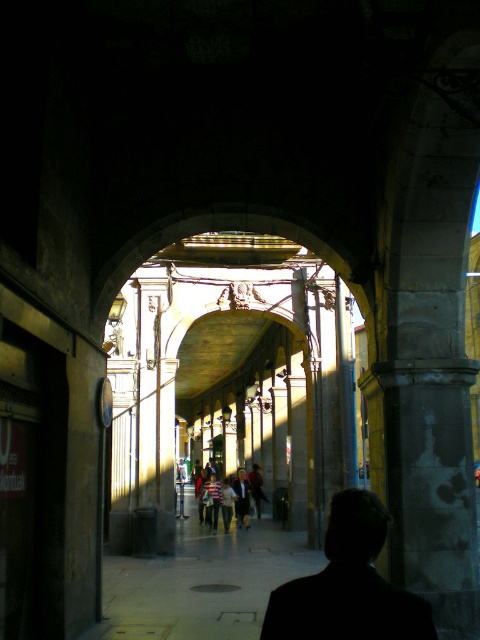
Question: In this image, where is black matte suit at center located relative to striped fabric shirt at center?

Choices:
 (A) above
 (B) below

Answer: (A)

Question: Which object is the farthest from the dark gray suit at center?

Choices:
 (A) black matte suit at center
 (B) striped fabric shirt at center

Answer: (A)

Question: Is black matte suit at center bigger than striped fabric shirt at center?

Choices:
 (A) yes
 (B) no

Answer: (A)

Question: Which object is closer to the camera taking this photo?

Choices:
 (A) striped fabric shirt at center
 (B) black matte suit at center

Answer: (B)

Question: Does black matte suit at center have a greater width compared to dark gray suit at center?

Choices:
 (A) yes
 (B) no

Answer: (A)

Question: Which of the following is the closest to the observer?

Choices:
 (A) black matte suit at center
 (B) dark gray suit at center
 (C) striped fabric shirt at center

Answer: (A)